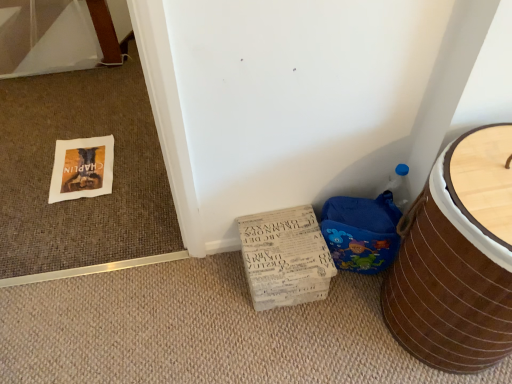
Question: Could white cardboard box at lower center be considered to be inside brown woven basket at lower right?

Choices:
 (A) yes
 (B) no

Answer: (B)

Question: From the image's perspective, is brown woven basket at lower right below white cardboard box at lower center?

Choices:
 (A) yes
 (B) no

Answer: (B)

Question: Is brown woven basket at lower right bigger than white cardboard box at lower center?

Choices:
 (A) yes
 (B) no

Answer: (A)

Question: Does brown woven basket at lower right have a greater width compared to white cardboard box at lower center?

Choices:
 (A) no
 (B) yes

Answer: (B)

Question: From the image's perspective, does brown woven basket at lower right appear higher than white cardboard box at lower center?

Choices:
 (A) yes
 (B) no

Answer: (A)

Question: From a real-world perspective, is brown woven basket at lower right positioned under white cardboard box at lower center based on gravity?

Choices:
 (A) no
 (B) yes

Answer: (A)

Question: From a real-world perspective, does white cardboard box at lower center sit lower than blue fabric potty at lower right?

Choices:
 (A) no
 (B) yes

Answer: (B)

Question: Can you confirm if white cardboard box at lower center is shorter than blue fabric potty at lower right?

Choices:
 (A) yes
 (B) no

Answer: (A)

Question: Is white cardboard box at lower center next to blue fabric potty at lower right and touching it?

Choices:
 (A) no
 (B) yes

Answer: (A)

Question: From a real-world perspective, does white cardboard box at lower center stand above blue fabric potty at lower right?

Choices:
 (A) yes
 (B) no

Answer: (B)

Question: Is there a large distance between white cardboard box at lower center and blue fabric potty at lower right?

Choices:
 (A) no
 (B) yes

Answer: (A)

Question: Can you confirm if white cardboard box at lower center is smaller than blue fabric potty at lower right?

Choices:
 (A) yes
 (B) no

Answer: (B)

Question: Is the position of blue fabric potty at lower right more distant than that of white cardboard box at lower center?

Choices:
 (A) yes
 (B) no

Answer: (B)